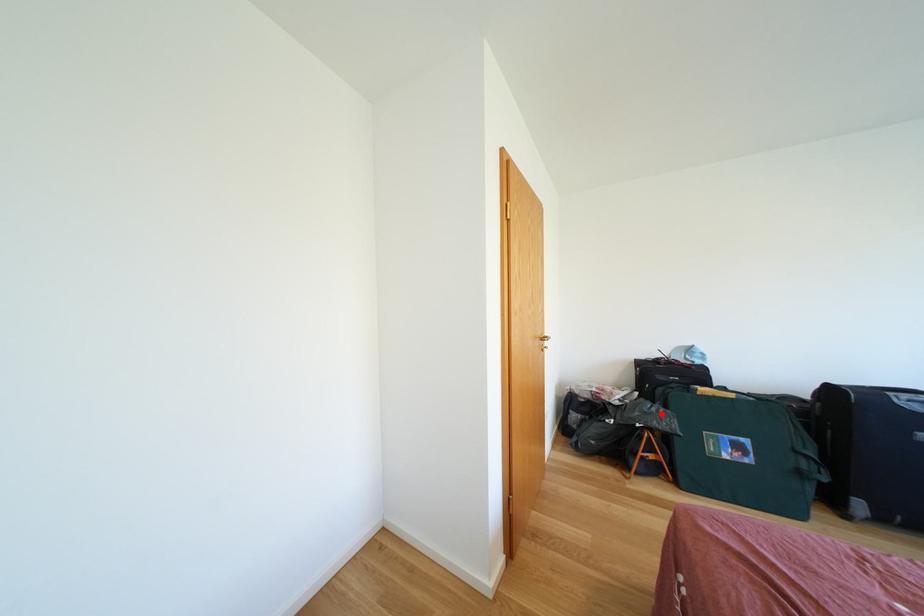
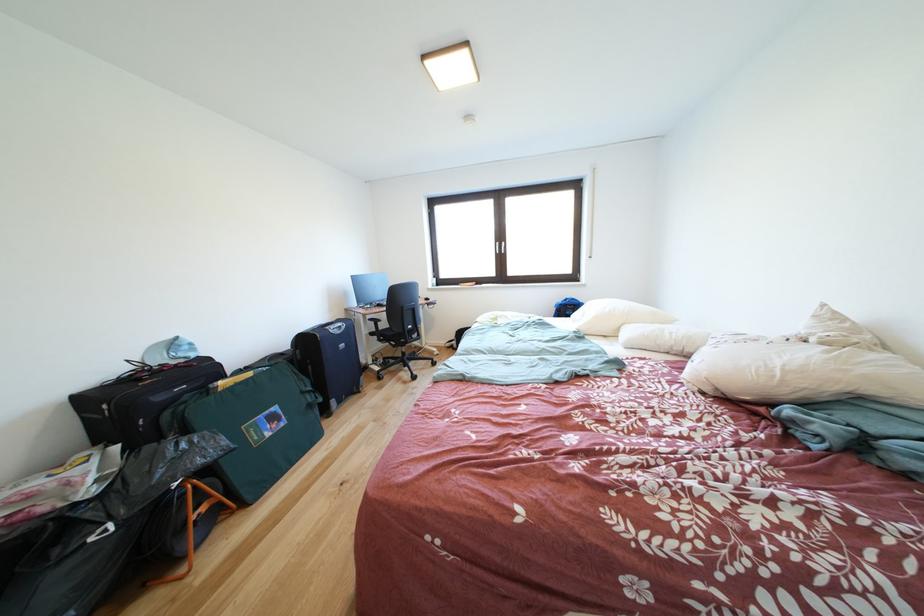
In the second image, find the point that corresponds to the highlighted location in the first image.

(191, 450)